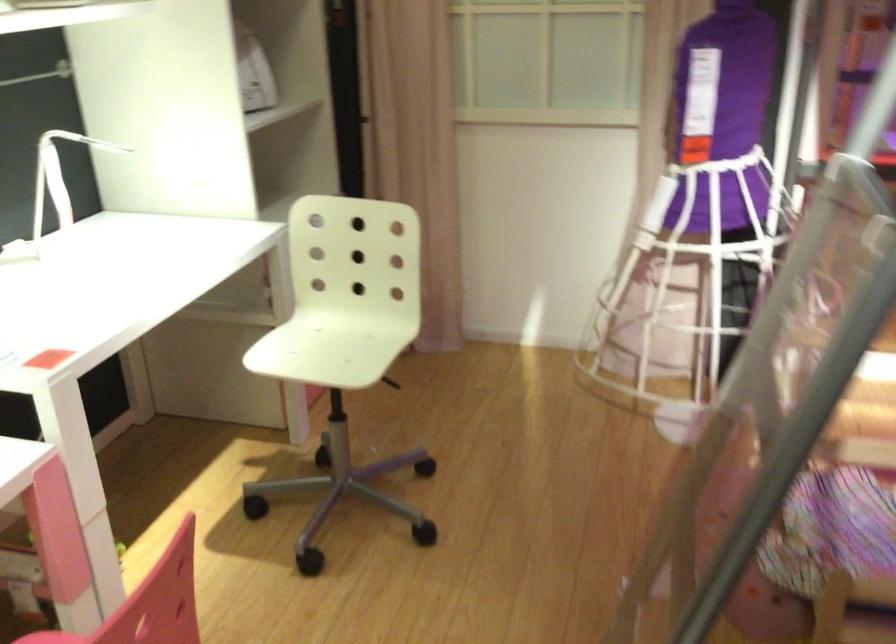
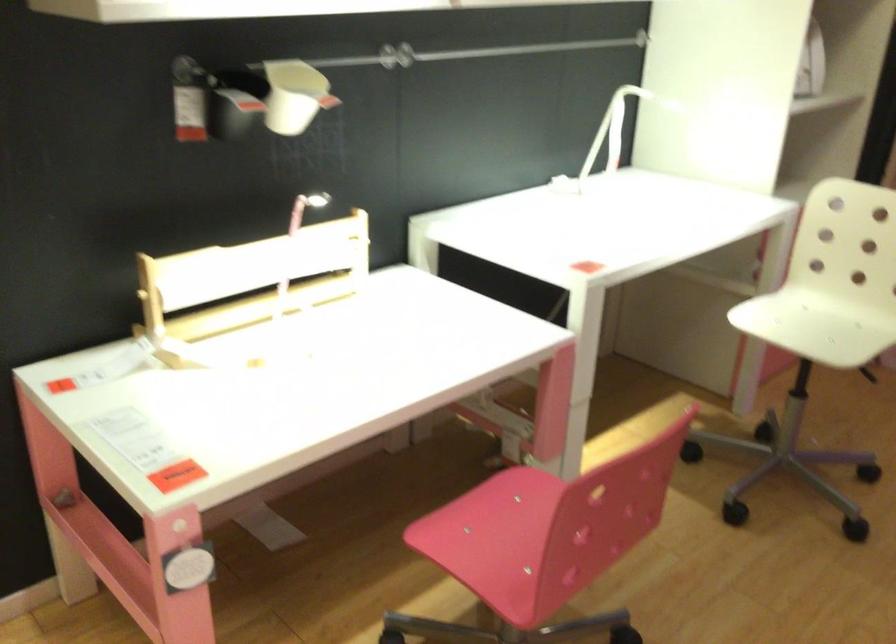
In the second image, find the point that corresponds to the point at 330,346 in the first image.

(812, 327)